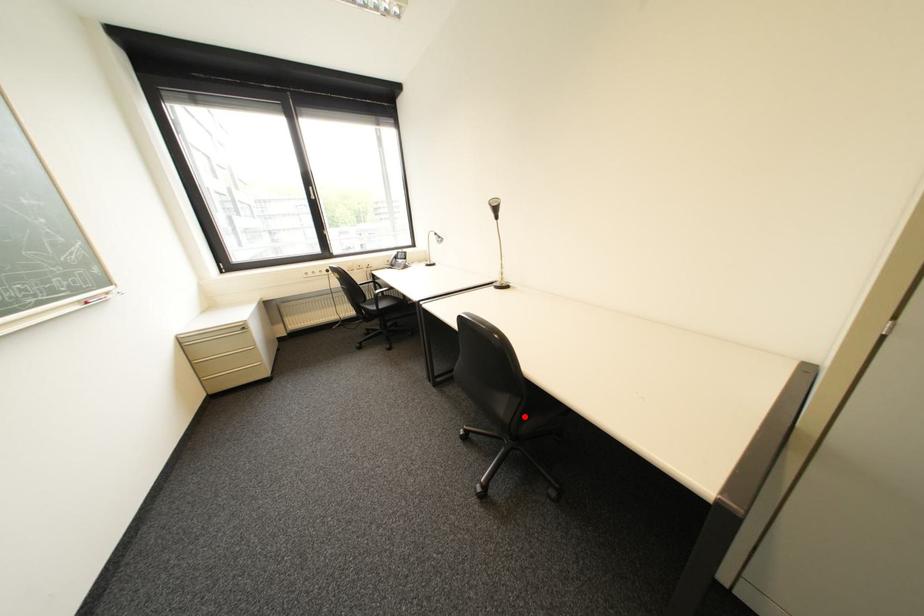
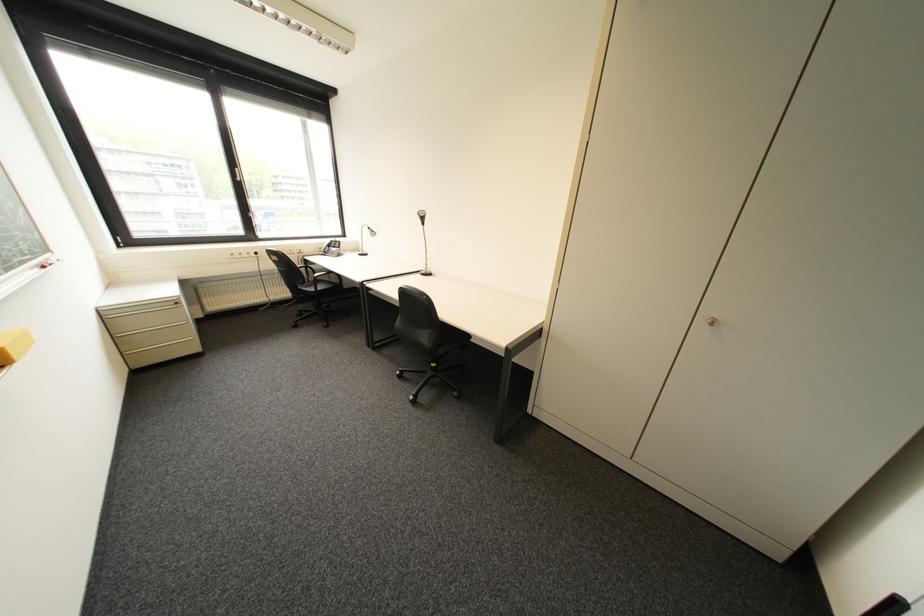
Where in the second image is the point corresponding to the highlighted location from the first image?

(444, 342)